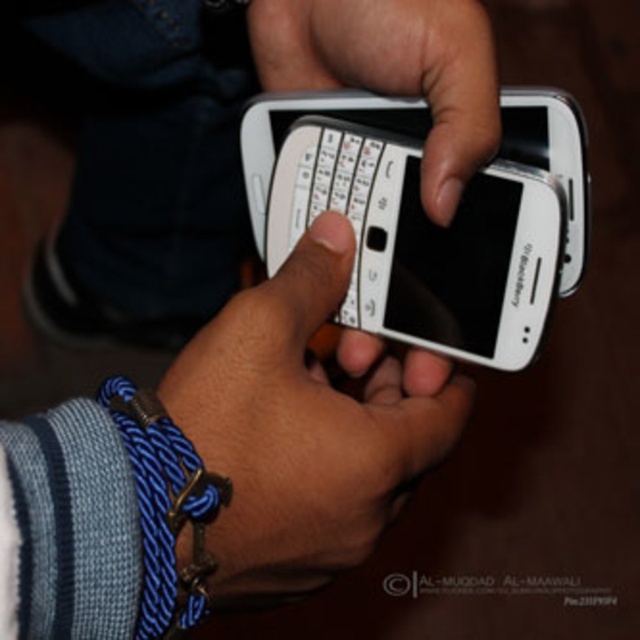
Question: Which is farther from the white plastic phone at center?

Choices:
 (A) white matte phone at center
 (B) white glossy phone at center
 (C) black matte text at center

Answer: (C)

Question: Which of the following is the farthest from the observer?

Choices:
 (A) (355, 140)
 (B) (358, 19)
 (C) (506, 586)

Answer: (C)

Question: Can you confirm if blue braided cord at lower left is positioned above black matte text at center?

Choices:
 (A) no
 (B) yes

Answer: (B)

Question: Is white glossy phone at center positioned at the back of blue braided cord at lower left?

Choices:
 (A) no
 (B) yes

Answer: (B)

Question: Does white matte phone at center have a smaller size compared to black matte text at center?

Choices:
 (A) no
 (B) yes

Answer: (A)

Question: Which of the following is the closest to the observer?

Choices:
 (A) (360, 8)
 (B) (353, 460)
 (C) (401, 584)

Answer: (B)